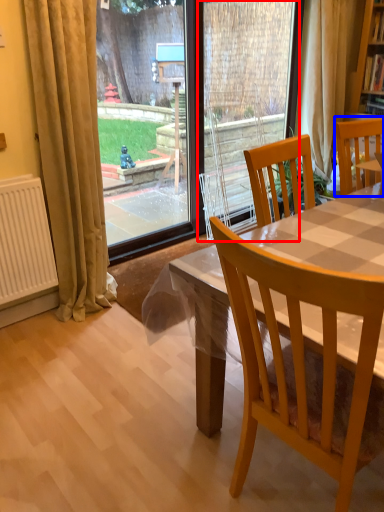
Question: Which point is further to the camera, screen door (highlighted by a red box) or chair (highlighted by a blue box)?

Choices:
 (A) screen door
 (B) chair

Answer: (A)